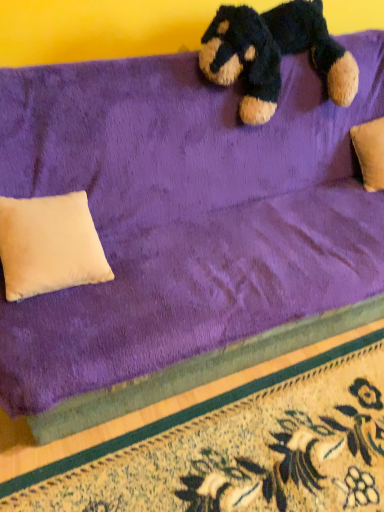
Question: From a real-world perspective, is velvety dark blue teddy bear at upper center beneath beige suede pillow at lower left?

Choices:
 (A) yes
 (B) no

Answer: (B)

Question: From a real-world perspective, is velvety dark blue teddy bear at upper center over beige suede pillow at lower left?

Choices:
 (A) yes
 (B) no

Answer: (A)

Question: Is velvety dark blue teddy bear at upper center far from beige suede pillow at lower left?

Choices:
 (A) no
 (B) yes

Answer: (A)

Question: Is velvety dark blue teddy bear at upper center thinner than beige suede pillow at lower left?

Choices:
 (A) yes
 (B) no

Answer: (A)

Question: Considering the relative sizes of velvety dark blue teddy bear at upper center and beige suede pillow at lower left in the image provided, is velvety dark blue teddy bear at upper center bigger than beige suede pillow at lower left?

Choices:
 (A) yes
 (B) no

Answer: (A)

Question: Can you confirm if velvety dark blue teddy bear at upper center is smaller than beige suede pillow at lower left?

Choices:
 (A) yes
 (B) no

Answer: (B)

Question: Does floral carpet at lower right touch velvety dark blue teddy bear at upper center?

Choices:
 (A) no
 (B) yes

Answer: (A)

Question: Is floral carpet at lower right at the right side of velvety dark blue teddy bear at upper center?

Choices:
 (A) yes
 (B) no

Answer: (B)

Question: Can you confirm if floral carpet at lower right is wider than velvety dark blue teddy bear at upper center?

Choices:
 (A) yes
 (B) no

Answer: (A)

Question: Does floral carpet at lower right have a smaller size compared to velvety dark blue teddy bear at upper center?

Choices:
 (A) yes
 (B) no

Answer: (A)

Question: Would you say velvety dark blue teddy bear at upper center is part of floral carpet at lower right's contents?

Choices:
 (A) yes
 (B) no

Answer: (B)

Question: From a real-world perspective, is floral carpet at lower right under velvety dark blue teddy bear at upper center?

Choices:
 (A) no
 (B) yes

Answer: (B)

Question: Does floral carpet at lower right have a smaller size compared to beige suede pillow at lower left?

Choices:
 (A) no
 (B) yes

Answer: (A)